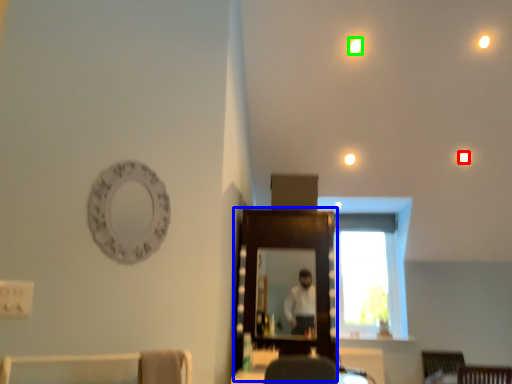
Question: Considering the real-world distances, which object is farthest from lighting (highlighted by a red box)? mirror (highlighted by a blue box) or lighting (highlighted by a green box)?

Choices:
 (A) mirror
 (B) lighting

Answer: (A)